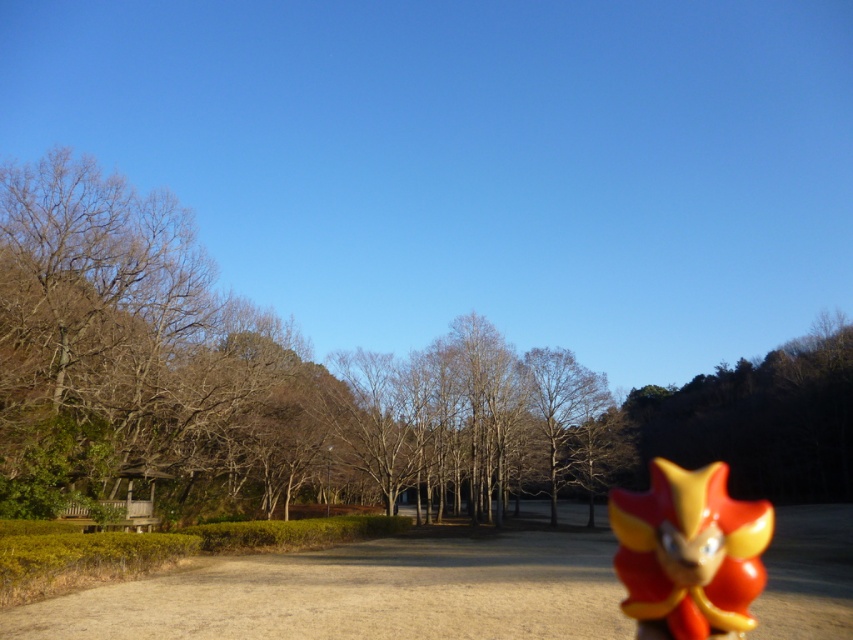
Between brown leafless trees at center and shiny orange plastic toy at lower right, which one is positioned higher?

brown leafless trees at center

Can you confirm if brown leafless trees at center is positioned to the right of shiny orange plastic toy at lower right?

No, brown leafless trees at center is not to the right of shiny orange plastic toy at lower right.

The width and height of the screenshot is (853, 640). What do you see at coordinates (248, 381) in the screenshot? I see `brown leafless trees at center` at bounding box center [248, 381].

Where is `brown leafless trees at center`? brown leafless trees at center is located at coordinates (248, 381).

Is smooth gravel path at center bigger than shiny orange plastic toy at lower right?

No.

Does smooth gravel path at center have a lesser height compared to shiny orange plastic toy at lower right?

Yes.

Identify the location of smooth gravel path at center. click(x=361, y=593).

Is point (25, 618) less distant than point (161, 548)?

That is True.

Can you confirm if smooth gravel path at center is positioned to the left of green leafy hedge at lower left?

Incorrect, smooth gravel path at center is not on the left side of green leafy hedge at lower left.

Is point (779, 568) behind point (38, 534)?

Yes, it is behind point (38, 534).

I want to click on smooth gravel path at center, so click(x=361, y=593).